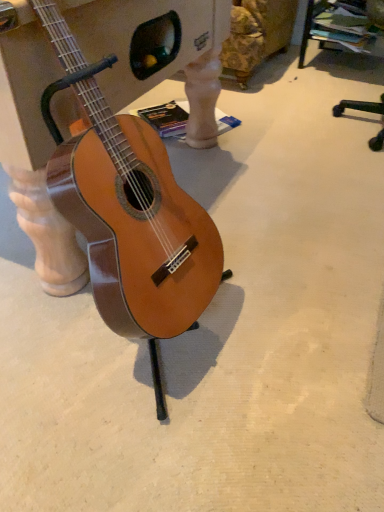
The image size is (384, 512). Identify the location of vacant area that is in front of natural wood guitar at center. (153, 440).